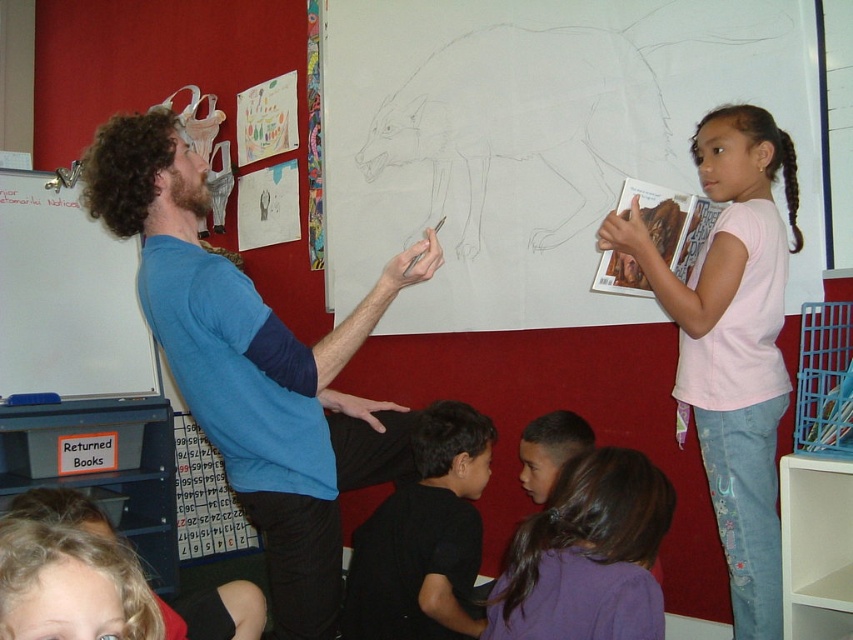
Who is positioned more to the right, blue t-shirt at upper left or whiteboard at left?

Positioned to the right is blue t-shirt at upper left.

Between blue t-shirt at upper left and whiteboard at left, which one appears on the left side from the viewer's perspective?

Positioned to the left is whiteboard at left.

Is point (177, 184) positioned behind point (38, 326)?

No.

You are a GUI agent. You are given a task and a screenshot of the screen. Output one action in this format:
    pyautogui.click(x=<x>, y=<y>)
    Task: Click on the blue t-shirt at upper left
    This screenshot has width=853, height=640.
    Given the screenshot: What is the action you would take?
    pyautogui.click(x=254, y=365)

Is white paper at upper center wider than pink cotton shirt at upper right?

Correct, the width of white paper at upper center exceeds that of pink cotton shirt at upper right.

Does white paper at upper center have a larger size compared to pink cotton shirt at upper right?

Correct, white paper at upper center is larger in size than pink cotton shirt at upper right.

Image resolution: width=853 pixels, height=640 pixels. In order to click on white paper at upper center in this screenshot , I will do `click(538, 141)`.

Between blue t-shirt at upper left and purple fabric hair at lower center, which one appears on the right side from the viewer's perspective?

purple fabric hair at lower center

Is blue t-shirt at upper left below purple fabric hair at lower center?

No, blue t-shirt at upper left is not below purple fabric hair at lower center.

Is point (247, 369) behind point (605, 588)?

Yes, it is.

Find the location of `blue t-shirt at upper left`. blue t-shirt at upper left is located at coordinates (254, 365).